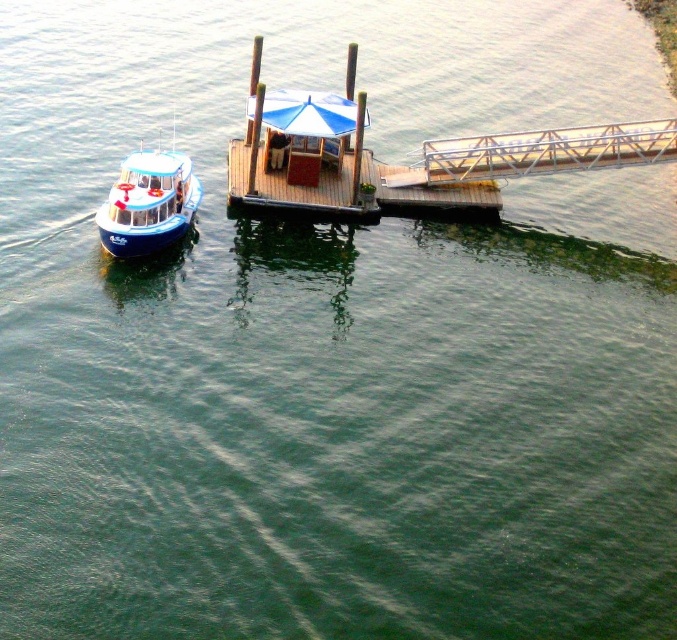
You are standing on the metallic gray dock at upper right and want to board the blue glossy boat at left. Considering their heights, will you need to climb down to reach the boat?

The metallic gray dock at upper right is taller than the blue glossy boat at left, so yes, you will need to climb down to reach the boat.

You are standing at the edge of the metallic gray dock at upper right and want to board the blue glossy boat at left. Which direction should you move to reach the boat?

You should move towards the left to reach the blue glossy boat at left since the metallic gray dock at upper right is further away from you than the boat.

You are planning to move the blue glossy boat at left to the metallic gray dock at upper right. Considering their widths, will the boat fit entirely on the dock without overhanging?

The metallic gray dock at upper right is wider than the blue glossy boat at left, so the boat will fit entirely on the dock without overhanging.